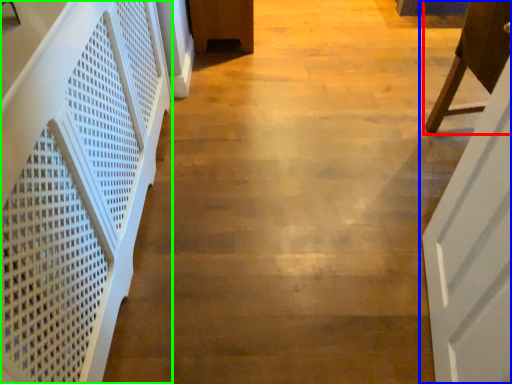
Question: Estimate the real-world distances between objects in this image. Which object is farther from furniture (highlighted by a red box), door (highlighted by a blue box) or stairwell (highlighted by a green box)?

Choices:
 (A) door
 (B) stairwell

Answer: (B)